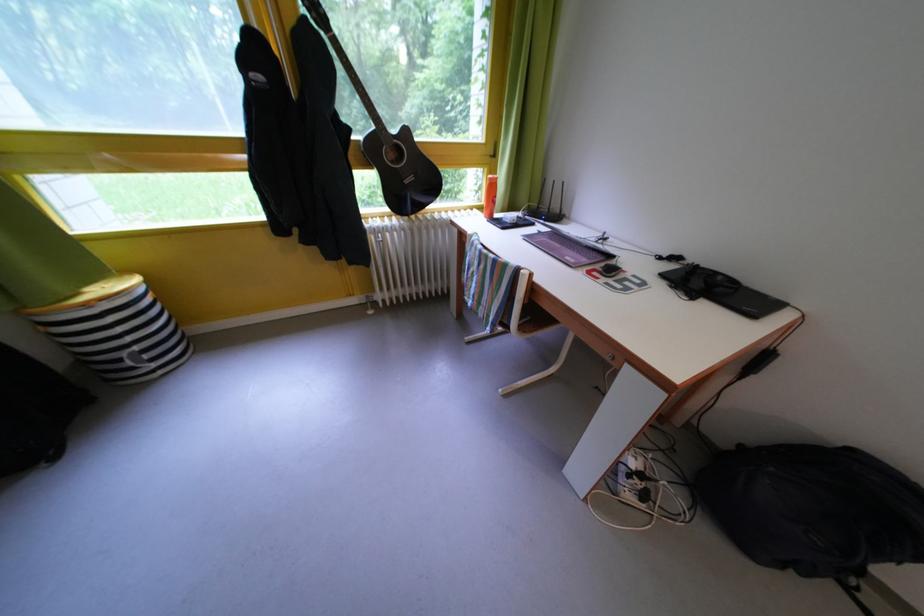
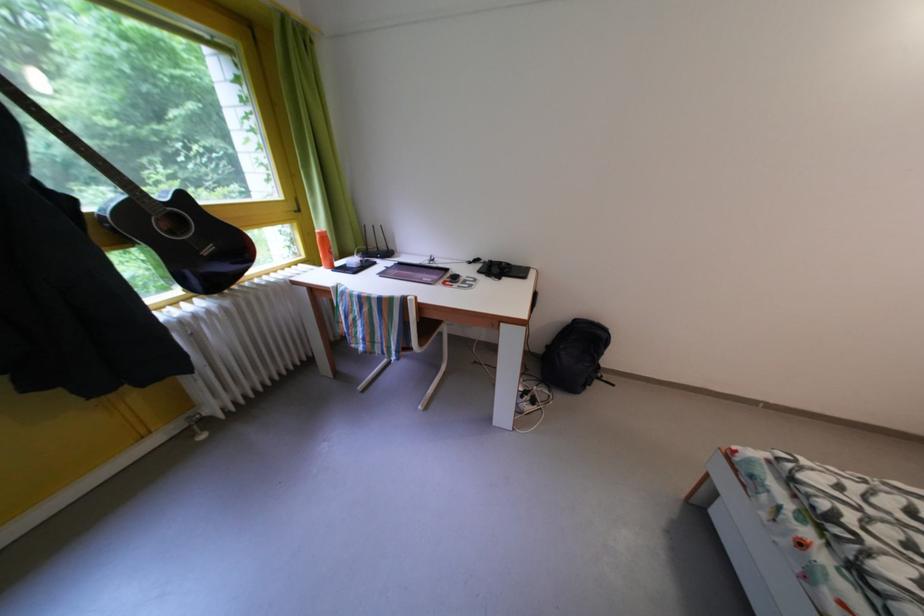
Where in the second image is the point corresponding to point 751,453 from the first image?

(556, 353)